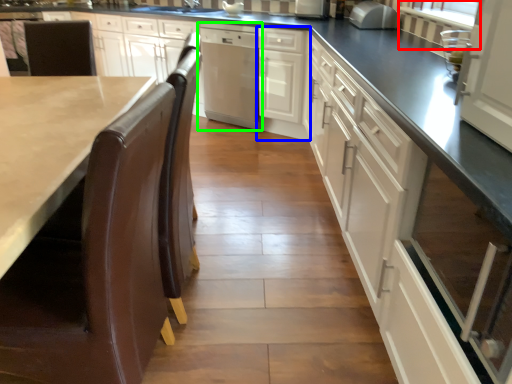
Question: Which object is positioned farthest from window screen (highlighted by a red box)? Select from cabinetry (highlighted by a blue box) and home appliance (highlighted by a green box).

Choices:
 (A) cabinetry
 (B) home appliance

Answer: (B)